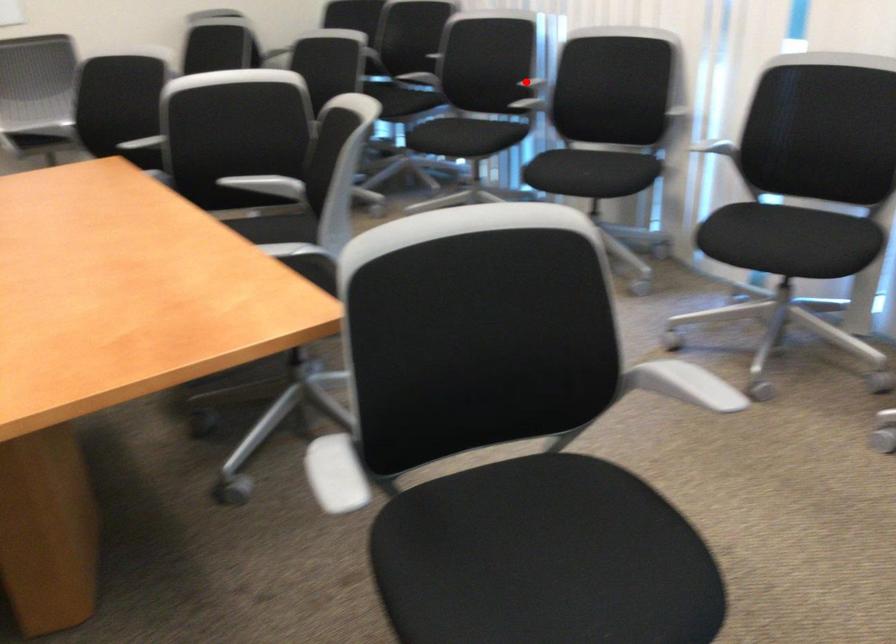
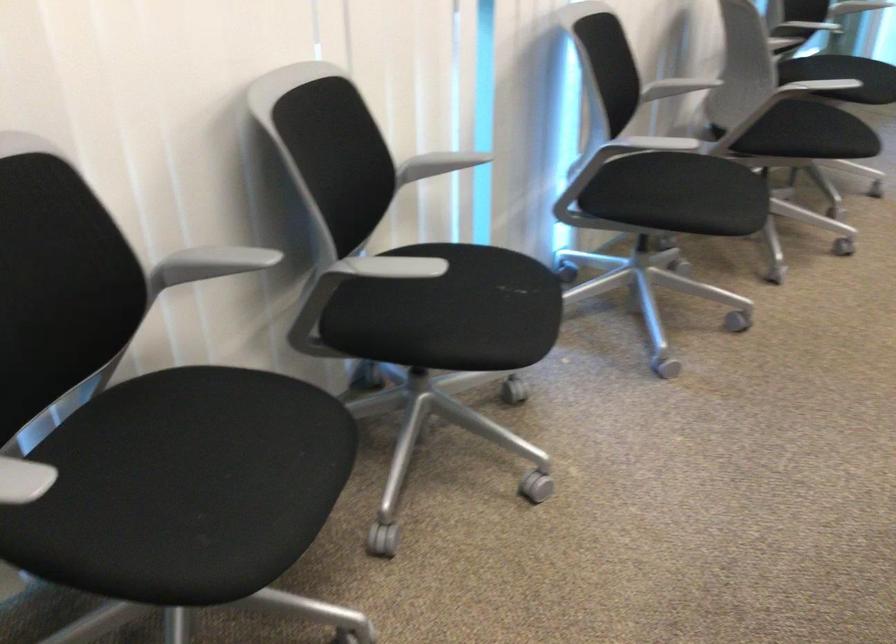
Question: I am providing you with two images of the same scene from different viewpoints. Given a red point in image1, look at the same physical point in image2. Is it:

Choices:
 (A) Closer to the viewpoint
 (B) Farther from the viewpoint

Answer: (A)